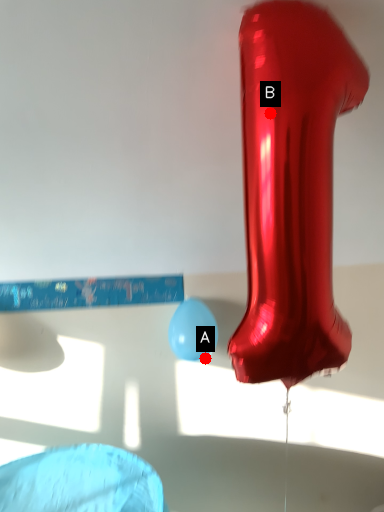
Question: Two points are circled on the image, labeled by A and B beside each circle. Which of the following is the closest to the observer?

Choices:
 (A) A is closer
 (B) B is closer

Answer: (B)